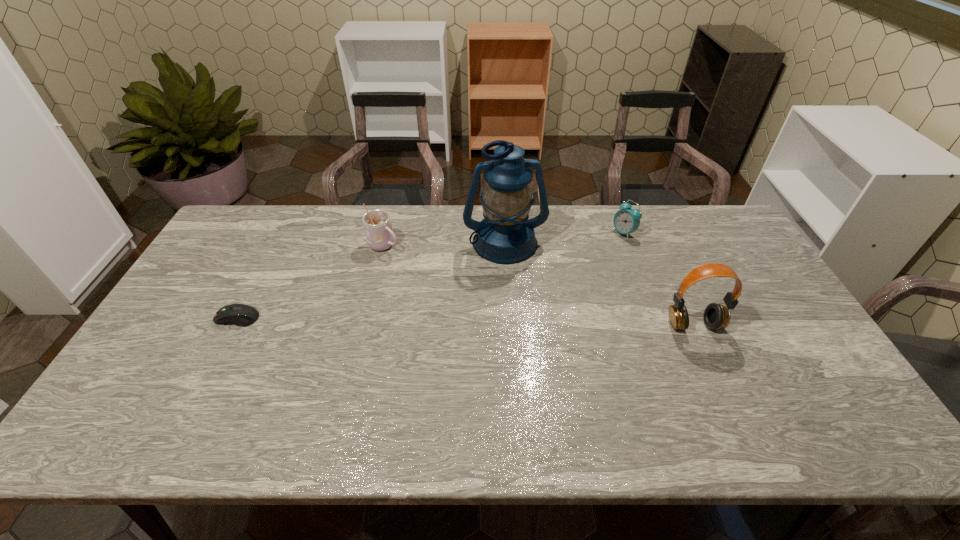
Locate an element on the screen. This screenshot has height=540, width=960. the leftmost object is located at coordinates (242, 315).

Find the location of a particular element. This screenshot has height=540, width=960. the shortest object is located at coordinates (242, 315).

Locate an element on the screen. Image resolution: width=960 pixels, height=540 pixels. headset is located at coordinates (716, 316).

Identify the location of alarm clock. (626, 220).

Locate an element on the screen. the second object from left to right is located at coordinates point(377,224).

Where is `cup`? The height and width of the screenshot is (540, 960). cup is located at coordinates 377,224.

Where is `lantern`? Image resolution: width=960 pixels, height=540 pixels. lantern is located at coordinates (505, 236).

Identify the location of the tallest object. Image resolution: width=960 pixels, height=540 pixels. (505, 236).

I want to click on free location located on the button of the computer equipment, so click(170, 318).

The width and height of the screenshot is (960, 540). I want to click on free location located 0.110m on the button of the computer equipment, so click(178, 318).